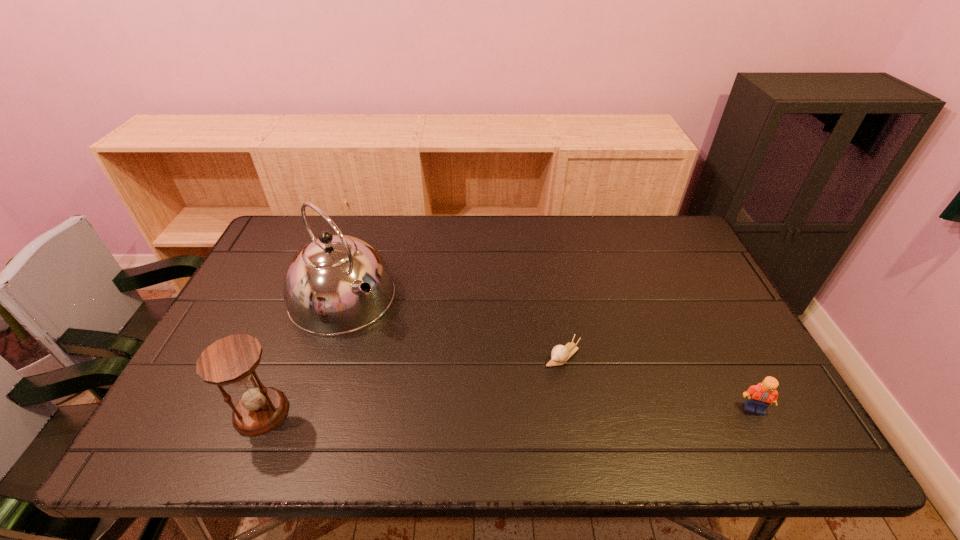
Locate an element on the screen. The width and height of the screenshot is (960, 540). blank space at the far edge is located at coordinates (403, 217).

Find the location of a particular element. This screenshot has width=960, height=540. free location at the near edge is located at coordinates (x=555, y=395).

Identify the location of free spot at the left edge of the desktop. (269, 323).

This screenshot has height=540, width=960. In the image, there is a desktop. Identify the location of vacant space at the right edge. (706, 307).

The image size is (960, 540). I want to click on vacant area at the far left corner, so click(x=269, y=250).

In the image, there is a desktop. At what (x,y) coordinates should I click in order to perform the action: click on free region at the far right corner. Please return your answer as a coordinate pair (x, y). The width and height of the screenshot is (960, 540). Looking at the image, I should click on (683, 248).

Identify the location of vacant space at the near right corner. (789, 414).

Find the location of a particular element. The image size is (960, 540). vacant space that is in between the rightmost object and the second tallest object is located at coordinates (508, 410).

This screenshot has width=960, height=540. Find the location of `vacant space that is in between the third nearest object and the second shortest object`. vacant space that is in between the third nearest object and the second shortest object is located at coordinates (659, 382).

I want to click on vacant space that's between the tallest object and the hourglass, so click(x=301, y=354).